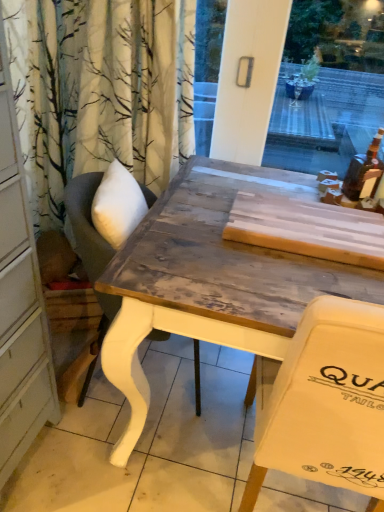
Question: Is point (349, 189) positioned closer to the camera than point (157, 332)?

Choices:
 (A) farther
 (B) closer

Answer: (A)

Question: In terms of size, does translucent amber bottle at upper right appear bigger or smaller than wooden chair at center?

Choices:
 (A) small
 (B) big

Answer: (A)

Question: Based on their relative distances, which object is farther from the translucent amber bottle at upper right?

Choices:
 (A) wooden chair at center
 (B) wooden table at center

Answer: (A)

Question: Considering the real-world distances, which object is closest to the wooden table at center?

Choices:
 (A) translucent amber bottle at upper right
 (B) wooden chair at center

Answer: (B)